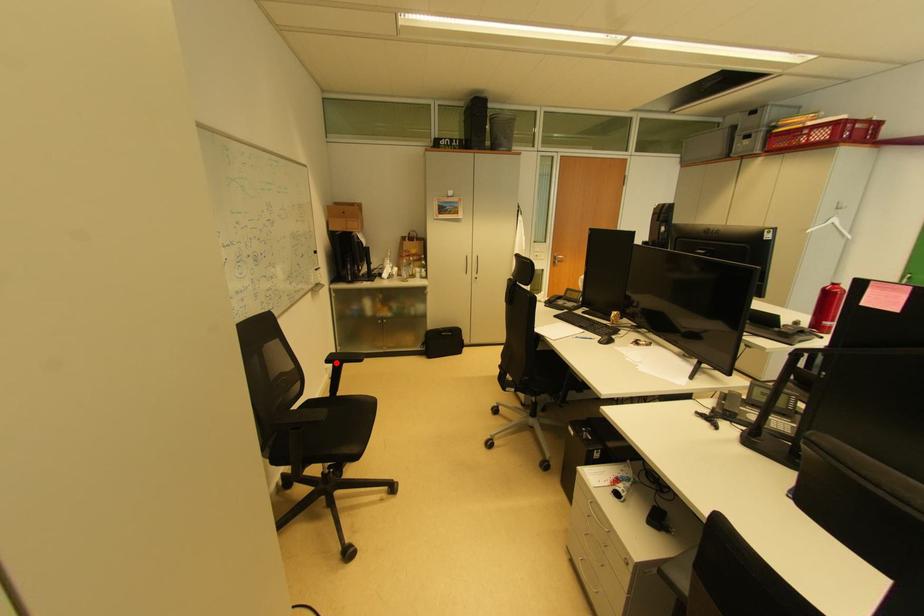
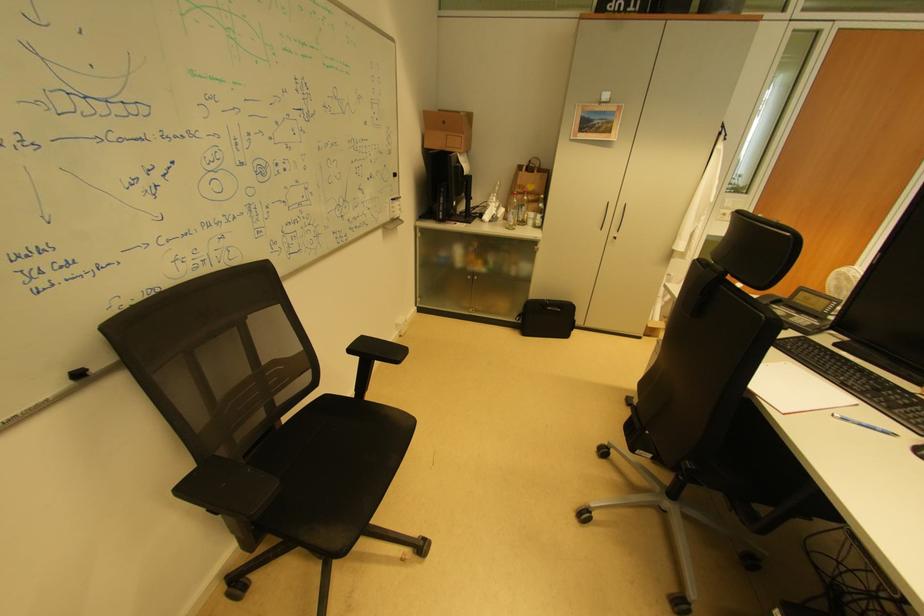
Find the pixel in the second image that matches the highlighted location in the first image.

(359, 352)